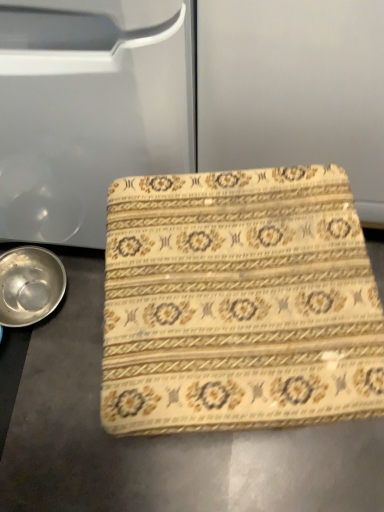
Identify the location of beige floral fabric at center. The image size is (384, 512). (238, 303).

In order to face beige floral fabric at center, should I rotate leftwards or rightwards?

You should look right and rotate roughly 4.324 degrees.

What do you see at coordinates (238, 303) in the screenshot?
I see `beige floral fabric at center` at bounding box center [238, 303].

Where is `metallic silver bowl at lower left`? metallic silver bowl at lower left is located at coordinates (29, 285).

The width and height of the screenshot is (384, 512). Describe the element at coordinates (29, 285) in the screenshot. I see `metallic silver bowl at lower left` at that location.

You are a GUI agent. You are given a task and a screenshot of the screen. Output one action in this format:
    pyautogui.click(x=<x>, y=<y>)
    Task: Click on the beige floral fabric at center
    Image resolution: width=384 pixels, height=512 pixels.
    Given the screenshot: What is the action you would take?
    pyautogui.click(x=238, y=303)

Considering the positions of objects beige floral fabric at center and metallic silver bowl at lower left in the image provided, who is more to the left, beige floral fabric at center or metallic silver bowl at lower left?

From the viewer's perspective, metallic silver bowl at lower left appears more on the left side.

Is beige floral fabric at center further to the viewer compared to metallic silver bowl at lower left?

No.

Which is behind, point (319, 201) or point (4, 261)?

The point (4, 261) is farther from the camera.

From the image's perspective, which one is positioned lower, beige floral fabric at center or metallic silver bowl at lower left?

beige floral fabric at center appears lower in the image.

From a real-world perspective, is beige floral fabric at center physically located above or below metallic silver bowl at lower left?

beige floral fabric at center is situated higher than metallic silver bowl at lower left in the real world.

Considering the sizes of objects beige floral fabric at center and metallic silver bowl at lower left in the image provided, who is thinner, beige floral fabric at center or metallic silver bowl at lower left?

metallic silver bowl at lower left.

Can you confirm if beige floral fabric at center is taller than metallic silver bowl at lower left?

Indeed, beige floral fabric at center has a greater height compared to metallic silver bowl at lower left.

Based on their sizes in the image, would you say beige floral fabric at center is bigger or smaller than metallic silver bowl at lower left?

beige floral fabric at center is bigger than metallic silver bowl at lower left.

Is beige floral fabric at center outside of metallic silver bowl at lower left?

Yes.

Are beige floral fabric at center and metallic silver bowl at lower left far apart?

That's not correct — beige floral fabric at center is a little close to metallic silver bowl at lower left.

Is beige floral fabric at center facing away from metallic silver bowl at lower left?

No, beige floral fabric at center's orientation is not away from metallic silver bowl at lower left.

How different are the orientations of beige floral fabric at center and metallic silver bowl at lower left in degrees?

They differ by 84.2 degrees in their facing directions.

Where is `beach towel that appears below the metallic silver bowl at lower left (from the image's perspective)`? The height and width of the screenshot is (512, 384). beach towel that appears below the metallic silver bowl at lower left (from the image's perspective) is located at coordinates (238, 303).

Considering the positions of objects metallic silver bowl at lower left and beige floral fabric at center in the image provided, who is more to the right, metallic silver bowl at lower left or beige floral fabric at center?

beige floral fabric at center is more to the right.

Considering their positions, is metallic silver bowl at lower left located in front of or behind beige floral fabric at center?

metallic silver bowl at lower left is positioned farther from the viewer than beige floral fabric at center.

Which point is more forward, (17, 250) or (231, 225)?

Point (231, 225)

From the image's perspective, would you say metallic silver bowl at lower left is shown under beige floral fabric at center?

No.

From a real-world perspective, is metallic silver bowl at lower left above or below beige floral fabric at center?

From a real-world perspective, metallic silver bowl at lower left is physically below beige floral fabric at center.

Considering the sizes of objects metallic silver bowl at lower left and beige floral fabric at center in the image provided, who is wider, metallic silver bowl at lower left or beige floral fabric at center?

beige floral fabric at center is wider.

Considering the relative sizes of metallic silver bowl at lower left and beige floral fabric at center in the image provided, is metallic silver bowl at lower left taller than beige floral fabric at center?

No.

Between metallic silver bowl at lower left and beige floral fabric at center, which one has larger size?

Bigger between the two is beige floral fabric at center.

Would you say metallic silver bowl at lower left contains beige floral fabric at center?

No, beige floral fabric at center is not inside metallic silver bowl at lower left.

In the scene shown: Is metallic silver bowl at lower left not close to beige floral fabric at center?

That's not correct — metallic silver bowl at lower left is a little close to beige floral fabric at center.

Could you tell me if metallic silver bowl at lower left is facing beige floral fabric at center?

Yes, metallic silver bowl at lower left is oriented towards beige floral fabric at center.

What's the angular difference between metallic silver bowl at lower left and beige floral fabric at center's facing directions?

They differ by 84.2 degrees in their facing directions.

Image resolution: width=384 pixels, height=512 pixels. Identify the location of bowl behind the beige floral fabric at center. (29, 285).

Locate an element on the screen. This screenshot has width=384, height=512. beach towel in front of the metallic silver bowl at lower left is located at coordinates (238, 303).

I want to click on beach towel on the right of metallic silver bowl at lower left, so click(238, 303).